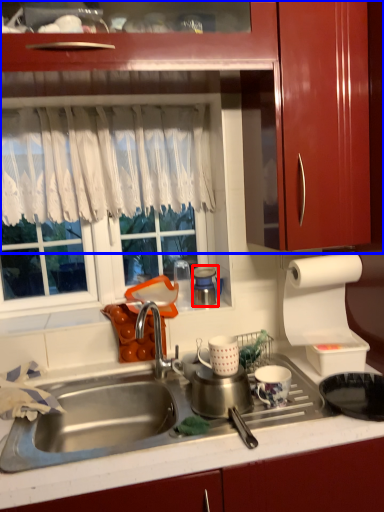
Question: Among these objects, which one is nearest to the camera, appliance (highlighted by a red box) or cabinetry (highlighted by a blue box)?

Choices:
 (A) appliance
 (B) cabinetry

Answer: (B)